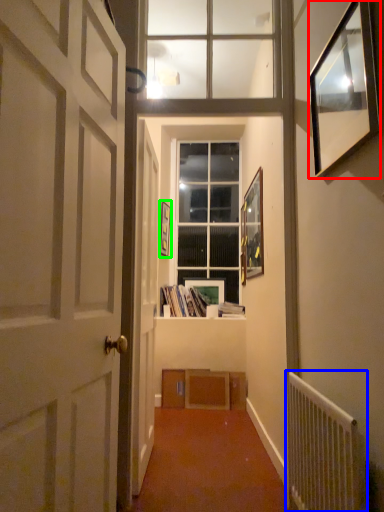
Question: Based on their relative distances, which object is farther from picture frame (highlighted by a red box)? Choose from radiator (highlighted by a blue box) and picture frame (highlighted by a green box).

Choices:
 (A) radiator
 (B) picture frame

Answer: (B)